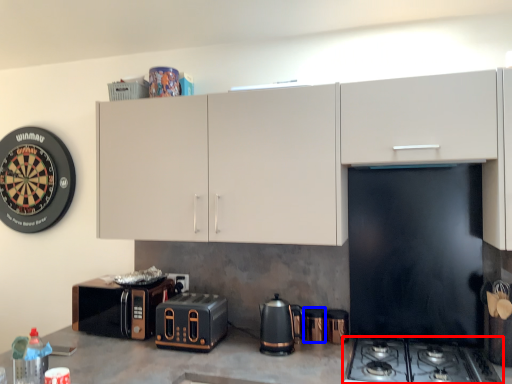
Question: Which object is closer to the camera taking this photo, gas stove (highlighted by a red box) or appliance (highlighted by a blue box)?

Choices:
 (A) gas stove
 (B) appliance

Answer: (A)